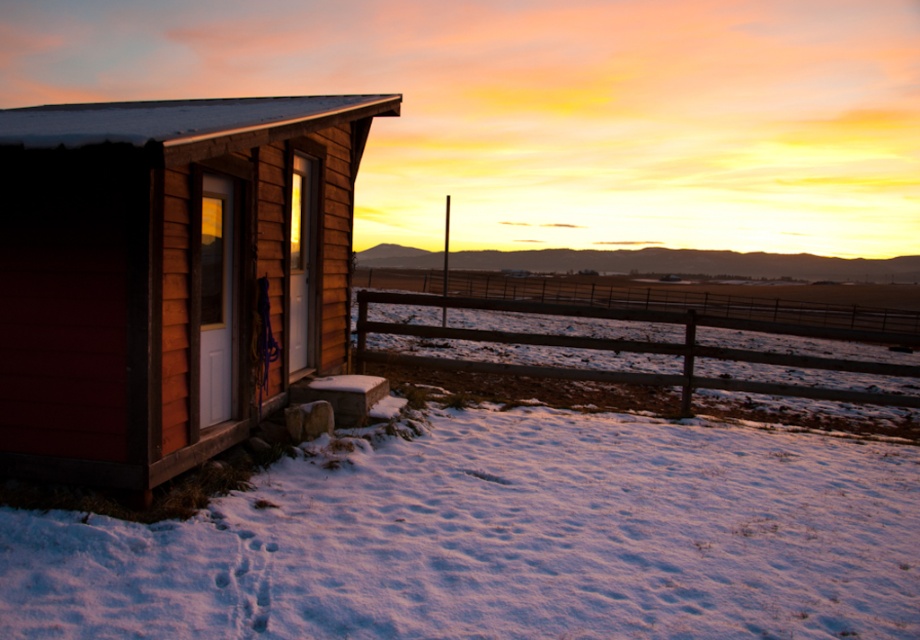
Consider the image. Who is more distant from viewer, (700, 420) or (521, 371)?

Positioned behind is point (521, 371).

Between white powdery snow at lower left and brown wooden fence at lower center, which one is positioned lower?

white powdery snow at lower left is below.

Is point (565, 468) farther from camera compared to point (727, 352)?

No, it is not.

Identify the location of white powdery snow at lower left. This screenshot has height=640, width=920. [x=502, y=540].

Does white powdery snow at lower left appear over wooden cabin at left?

No, white powdery snow at lower left is not above wooden cabin at left.

Identify the location of white powdery snow at lower left. (502, 540).

Find the location of a particular element. white powdery snow at lower left is located at coordinates (502, 540).

Is wooden cabin at left in front of brown wooden fence at lower center?

Yes, wooden cabin at left is in front of brown wooden fence at lower center.

Who is taller, wooden cabin at left or brown wooden fence at lower center?

brown wooden fence at lower center

The height and width of the screenshot is (640, 920). Find the location of `wooden cabin at left`. wooden cabin at left is located at coordinates (168, 275).